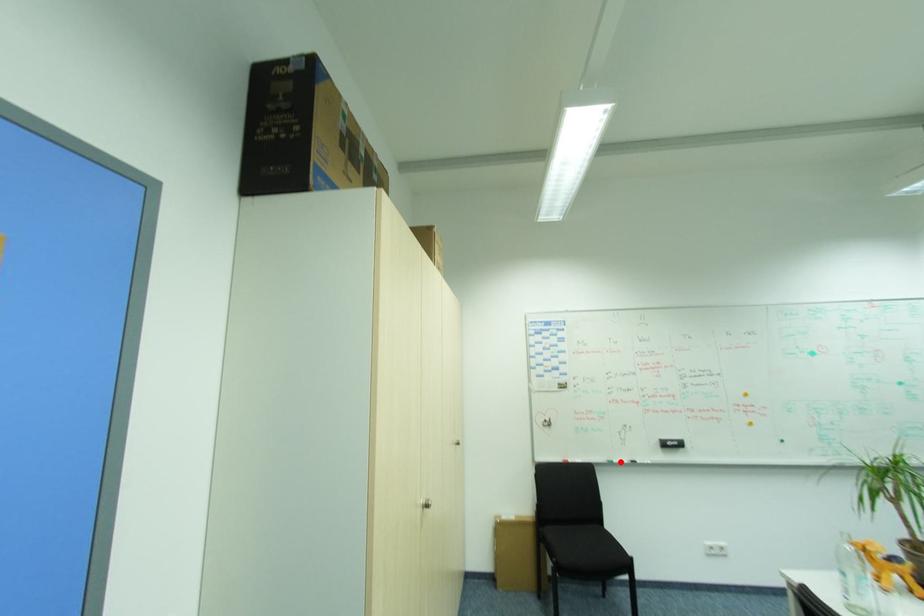
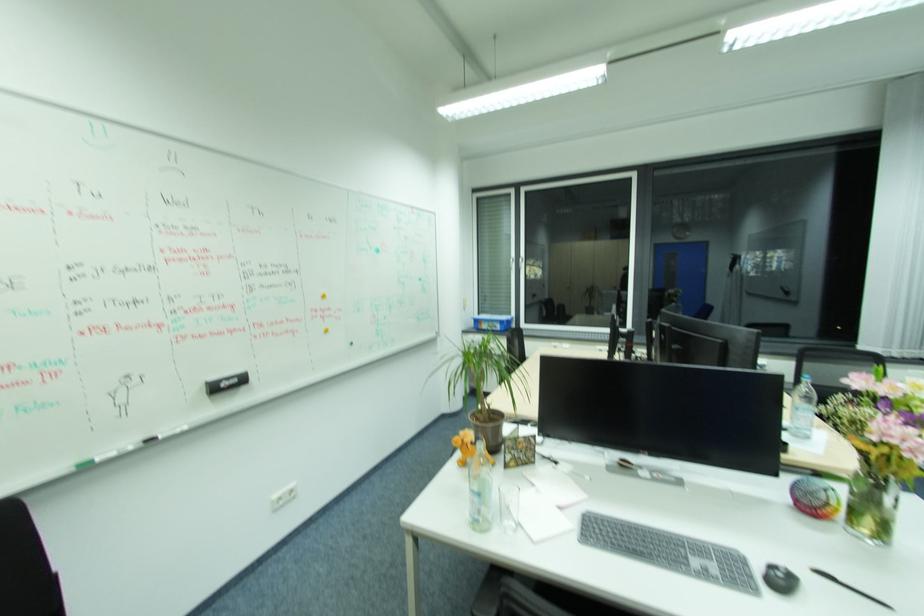
In the second image, find the point that corresponds to the highlighted location in the first image.

(105, 460)